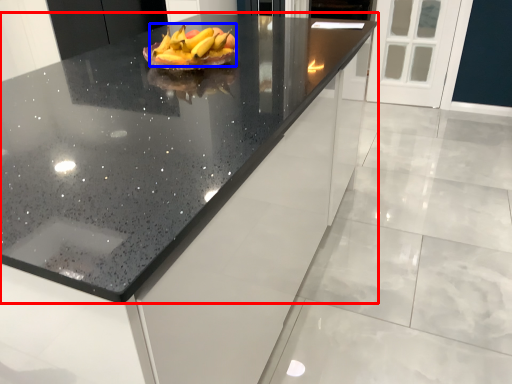
Question: Which of the following is the closest to the observer, countertop (highlighted by a red box) or grapefruit (highlighted by a blue box)?

Choices:
 (A) countertop
 (B) grapefruit

Answer: (A)